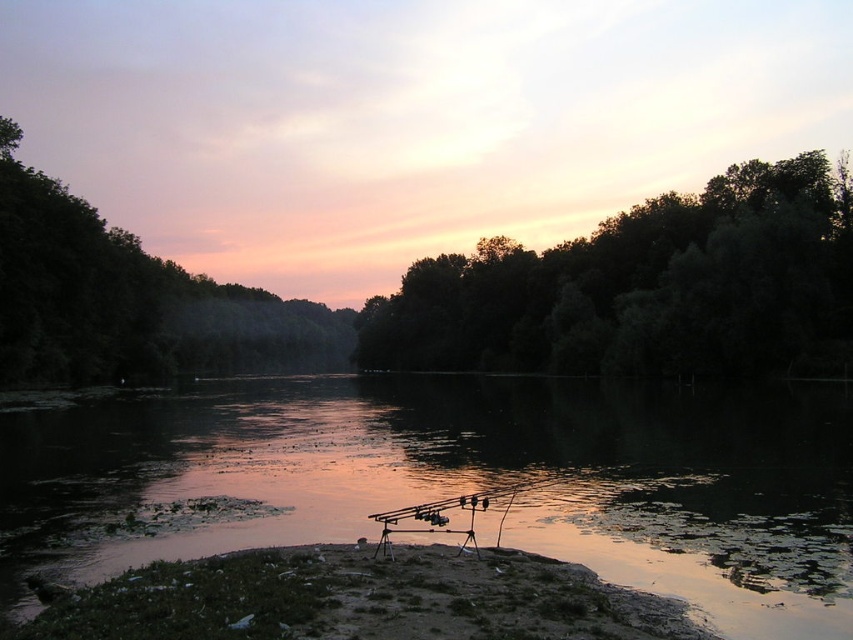
Question: Which point is farther to the camera?

Choices:
 (A) translucent water at center
 (B) dark green leafy trees at upper center
 (C) dark green leafy trees at upper left
 (D) brown dirt at lower center

Answer: (B)

Question: Considering the real-world distances, which object is closest to the dark green leafy trees at upper center?

Choices:
 (A) dark green leafy trees at upper left
 (B) brown dirt at lower center
 (C) translucent water at center

Answer: (C)

Question: Does translucent water at center lie in front of dark green leafy trees at upper center?

Choices:
 (A) yes
 (B) no

Answer: (A)

Question: Considering the real-world distances, which object is farthest from the translucent water at center?

Choices:
 (A) dark green leafy trees at upper center
 (B) dark green leafy trees at upper left

Answer: (B)

Question: Is translucent water at center to the right of dark green leafy trees at upper left from the viewer's perspective?

Choices:
 (A) yes
 (B) no

Answer: (A)

Question: Is dark green leafy trees at upper center above dark green leafy trees at upper left?

Choices:
 (A) no
 (B) yes

Answer: (A)